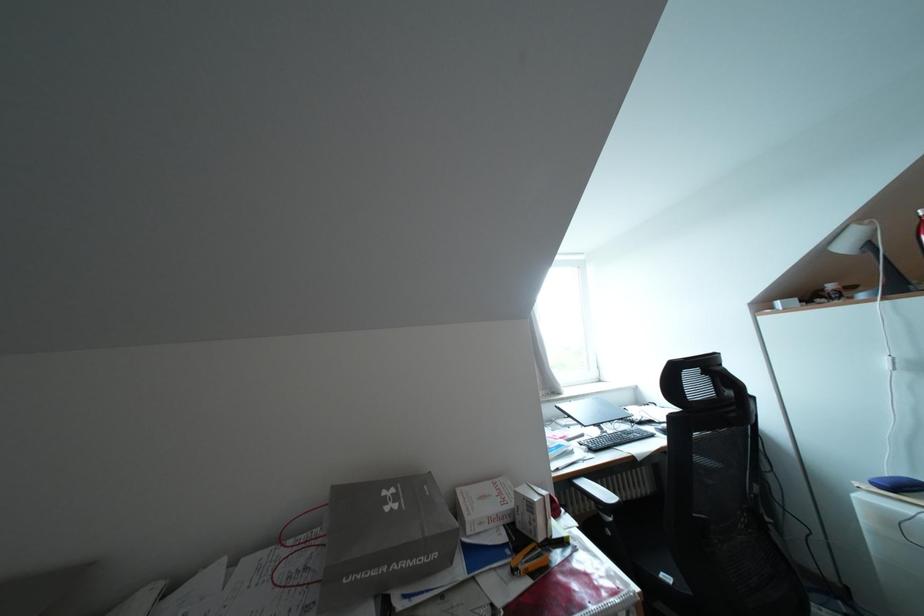
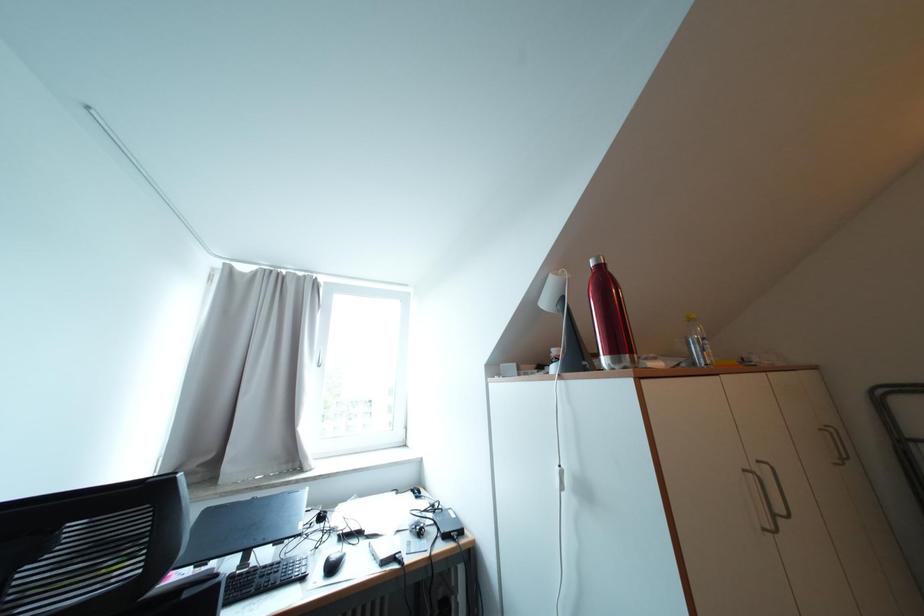
Question: What movement of the cameraman would produce the second image?

Choices:
 (A) Left
 (B) Right
 (C) Forward
 (D) Backward

Answer: (B)